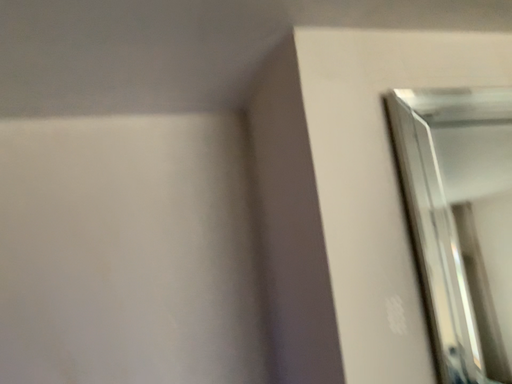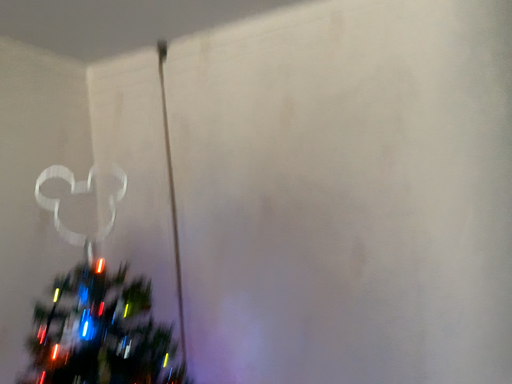
Question: How did the camera likely rotate when shooting the video?

Choices:
 (A) rotated upward
 (B) rotated downward

Answer: (B)